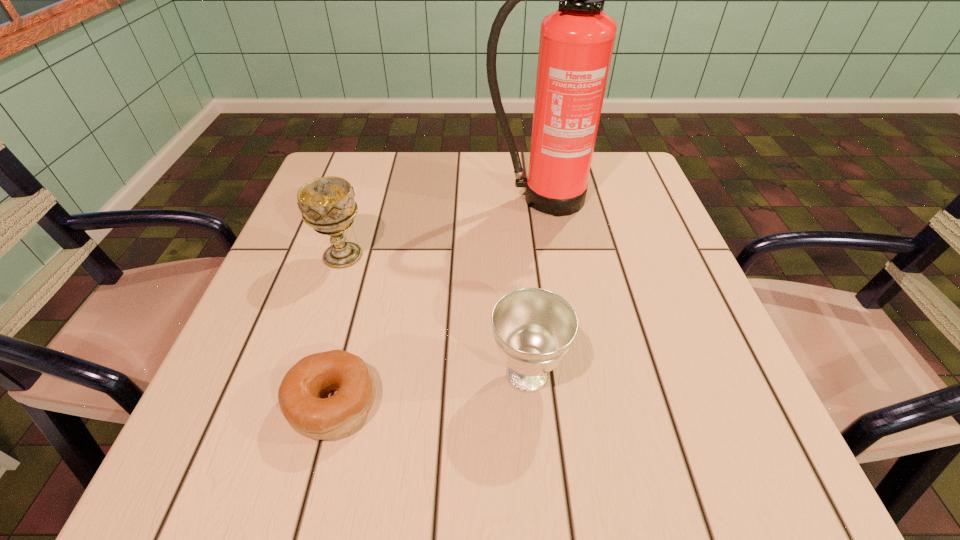
Where is `free region at the right edge of the desktop`? free region at the right edge of the desktop is located at coordinates (660, 224).

The image size is (960, 540). In the image, there is a desktop. Identify the location of vacant space at the far left corner. (318, 177).

The width and height of the screenshot is (960, 540). What are the coordinates of `vacant region at the far right corner of the desktop` in the screenshot? It's located at (612, 170).

Locate an element on the screen. Image resolution: width=960 pixels, height=540 pixels. free location at the near right corner of the desktop is located at coordinates (752, 488).

Image resolution: width=960 pixels, height=540 pixels. Identify the location of free spot between the shortest object and the third nearest object. (338, 329).

Find the location of a particular element. vacant area that lies between the tallest object and the shortest object is located at coordinates (437, 300).

This screenshot has width=960, height=540. Find the location of `free space that is in between the nearer chalice and the fire extinguisher`. free space that is in between the nearer chalice and the fire extinguisher is located at coordinates (534, 287).

Identify the location of vacant space that is in between the shortest object and the nearer chalice. (430, 388).

I want to click on free spot between the bagel and the second farthest object, so click(338, 329).

Where is `free space that is in between the left chalice and the shortest object`? This screenshot has height=540, width=960. free space that is in between the left chalice and the shortest object is located at coordinates coord(338,329).